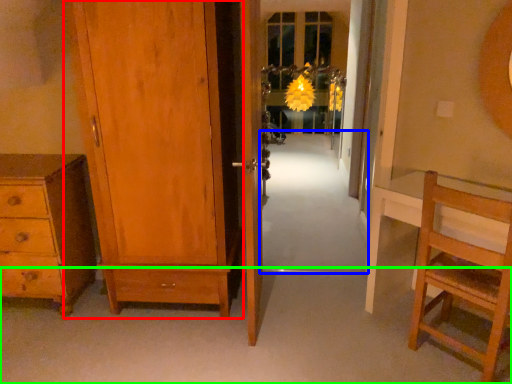
Question: Estimate the real-world distances between objects in this image. Which object is closer to door (highlighted by a red box), path (highlighted by a blue box) or path (highlighted by a green box)?

Choices:
 (A) path
 (B) path

Answer: (B)